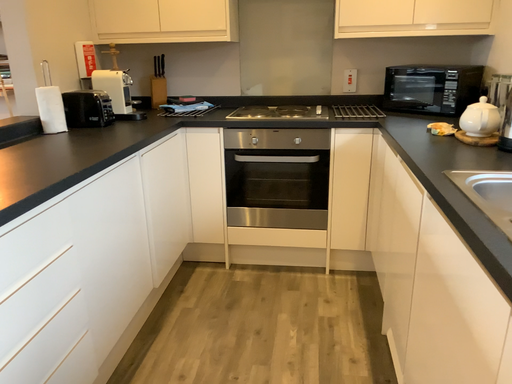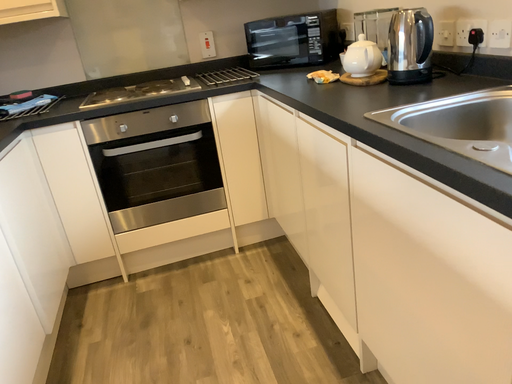
Question: How did the camera likely rotate when shooting the video?

Choices:
 (A) rotated left
 (B) rotated right

Answer: (B)